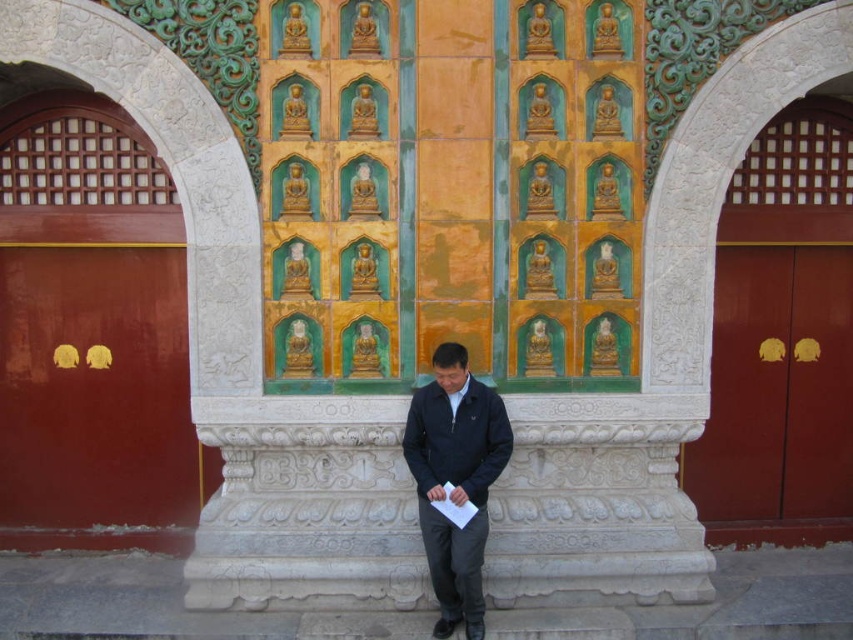
You are standing in a hallway with two doors. The smooth red wood door at left and the matte wood door at right. You need to choose the wider door to exit. Which one should you choose?

The matte wood door at right is wider than the smooth red wood door at left, so you should choose the matte wood door at right to exit.

Looking at this image, you are a delivery person carrying a package that is 3 feet wide. You need to walk through the path between the matte wood door at right and the dark blue jacket at center to reach the recipient. Is the path wide enough for your package?

The distance between the matte wood door at right and the dark blue jacket at center is 8.11 feet. Since your package is 3 feet wide, there is sufficient space for you to pass through the path.

You are standing in a hallway and see the smooth red wood door at left and the dark blue jacket at center. Which object is closer to you?

The smooth red wood door at left is closer to you because it is further to the viewer than the dark blue jacket at center.